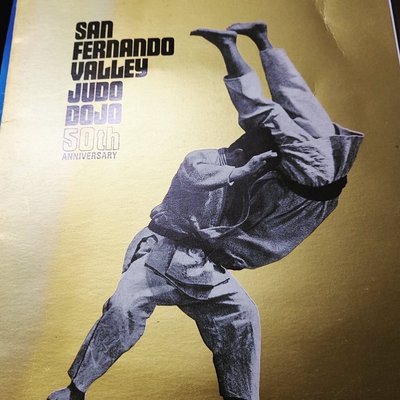
The height and width of the screenshot is (400, 400). In order to click on poster in this screenshot , I will do `click(359, 83)`.